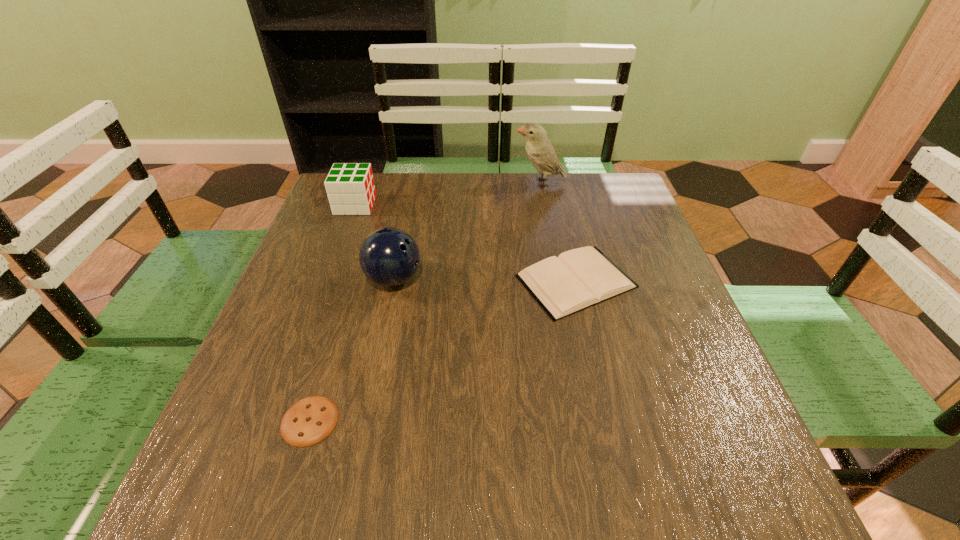
Locate an element on the screen. This screenshot has height=540, width=960. object at the far left corner is located at coordinates (350, 187).

Image resolution: width=960 pixels, height=540 pixels. I want to click on free space at the far edge of the desktop, so click(x=462, y=219).

This screenshot has height=540, width=960. Identify the location of vacant position at the near edge of the desktop. (497, 494).

Locate an element on the screen. The width and height of the screenshot is (960, 540). vacant space at the left edge of the desktop is located at coordinates (277, 450).

Locate an element on the screen. The height and width of the screenshot is (540, 960). vacant space at the right edge of the desktop is located at coordinates (599, 239).

The height and width of the screenshot is (540, 960). I want to click on vacant space at the far left corner of the desktop, so click(x=329, y=199).

Where is `free space at the near right corner`? free space at the near right corner is located at coordinates (778, 507).

Image resolution: width=960 pixels, height=540 pixels. Identify the location of free area in between the bowling ball and the second shortest object. (485, 280).

Locate an element on the screen. This screenshot has width=960, height=540. vacant space that's between the bird and the fourth tallest object is located at coordinates (558, 232).

You are a GUI agent. You are given a task and a screenshot of the screen. Output one action in this format:
    pyautogui.click(x=<x>, y=<y>)
    Task: Click on the free space between the fourth nearest object and the fourth tallest object
    
    Given the screenshot: What is the action you would take?
    pyautogui.click(x=466, y=243)